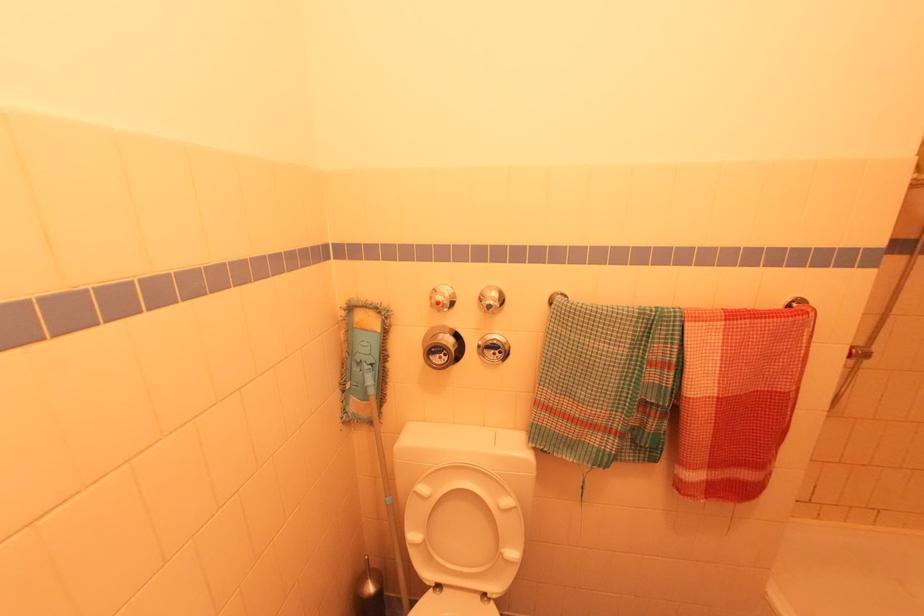
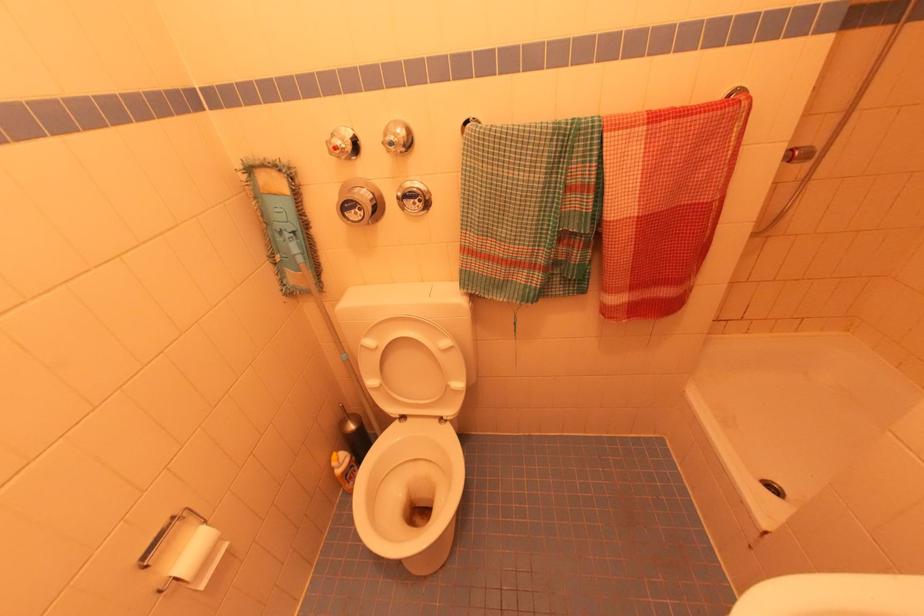
Question: Based on the continuous images, in which direction is the camera rotating? Reply with the corresponding letter.

Choices:
 (A) Left
 (B) Right
 (C) Up
 (D) Down

Answer: (D)